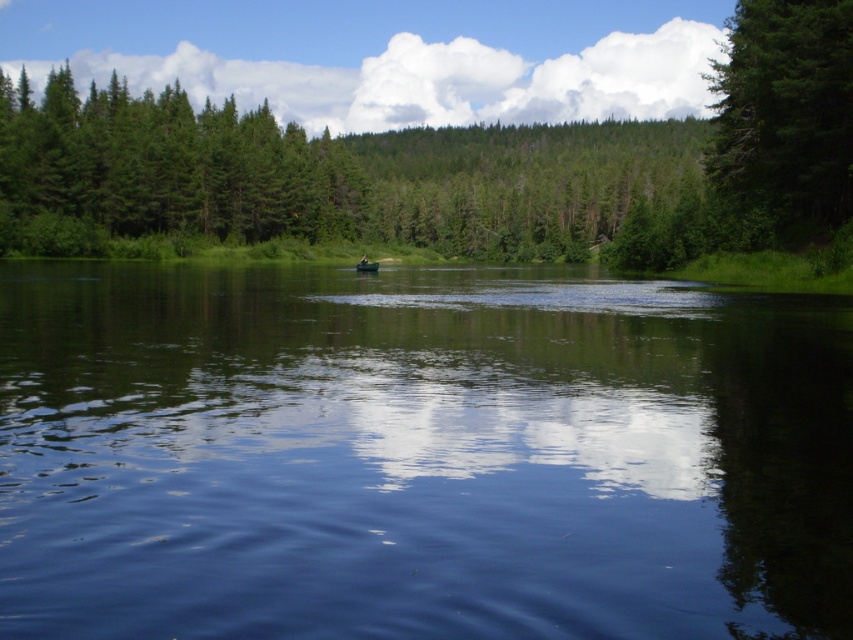
You are standing on the shore of the lake and want to compare the sizes of the transparent blue water at center and the green matte tree at upper right. Which one appears narrower in the image?

The transparent blue water at center appears narrower than the green matte tree at upper right because it is described as thinner.

From the picture: You are standing on the shore of the lake and see the transparent blue water at center and the green matte tree at upper right. Which object is closer to your left side?

The transparent blue water at center is to the left of the green matte tree at upper right, so it is closer to your left side.